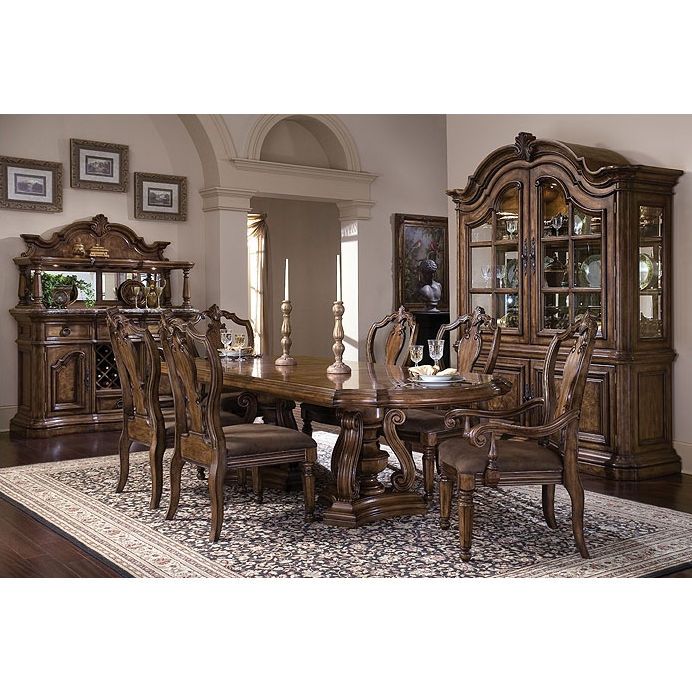
Image resolution: width=692 pixels, height=692 pixels. I want to click on chairs, so click(151, 370), click(226, 329), click(237, 444), click(398, 335), click(466, 338), click(562, 394).